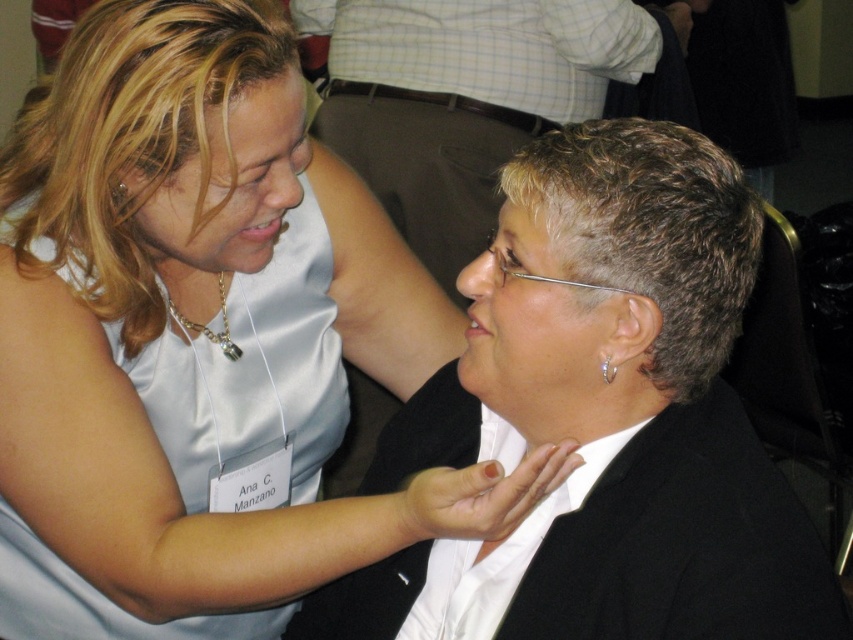
Consider the image. You are a photographer at a social event and notice two items in the frame. You have a white satin dress at upper left and a gray matte hair at center. Which item is larger in size?

The gray matte hair at center is larger than the white satin dress at upper left.

You are a photographer at a social event and want to focus your camera on the white glossy shirt at center and the gray matte hair at center. Which object should you adjust your focus to first if you want to capture both in sharp detail?

The white glossy shirt at center is closer to the viewer than the gray matte hair at center, so you should focus on the white glossy shirt at center first to ensure both are in sharp detail.

In the scene, there is a point labeled as point (189, 339). Which object does this point correspond to?

The point (189, 339) corresponds to the white satin dress at upper left.